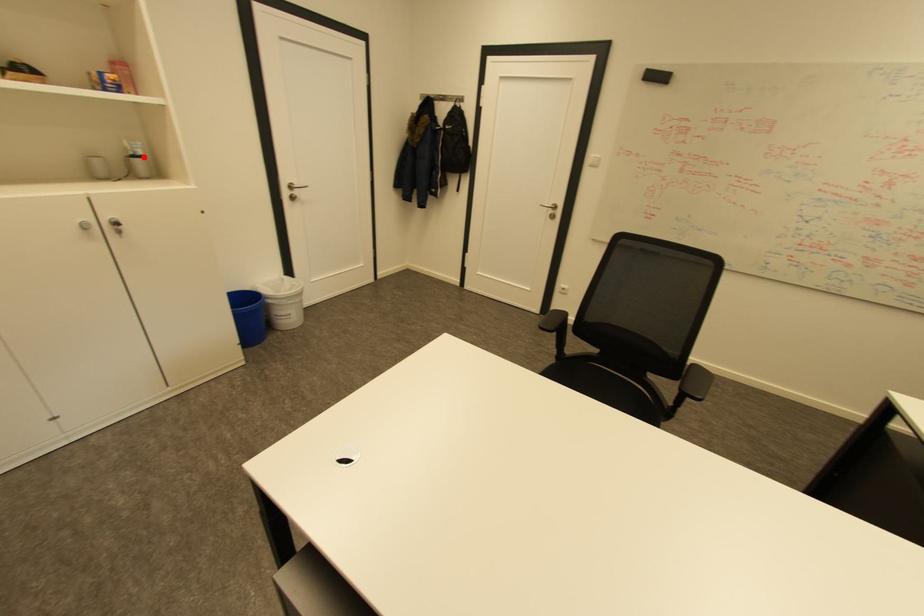
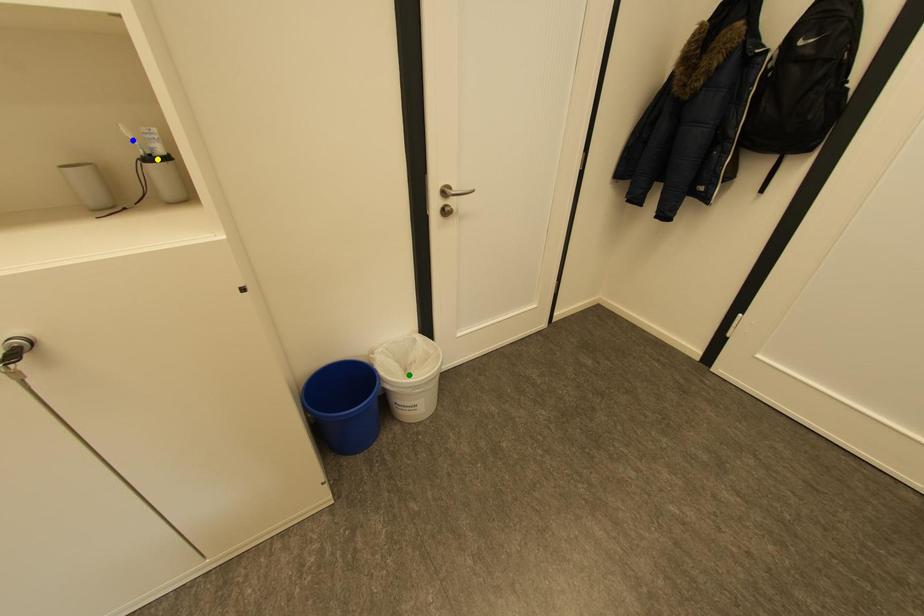
Question: I am providing you with two images of the same scene from different viewpoints. A red point is marked on the first image. You are given multiple points on the second image. Which point in image 2 is actually the same real-world point as the red point in image 1?

Choices:
 (A) blue point
 (B) green point
 (C) yellow point

Answer: (C)